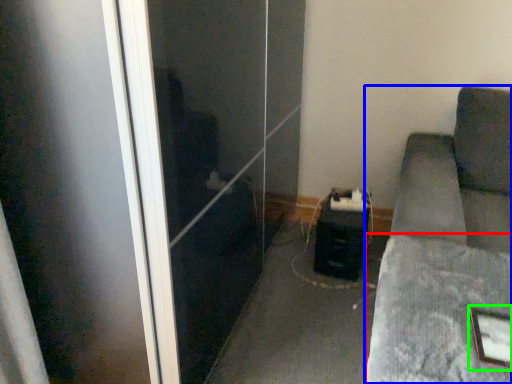
Question: Based on their relative distances, which object is farther from concrete (highlighted by a red box)? Choose from furniture (highlighted by a blue box) and picture frame (highlighted by a green box).

Choices:
 (A) furniture
 (B) picture frame

Answer: (B)